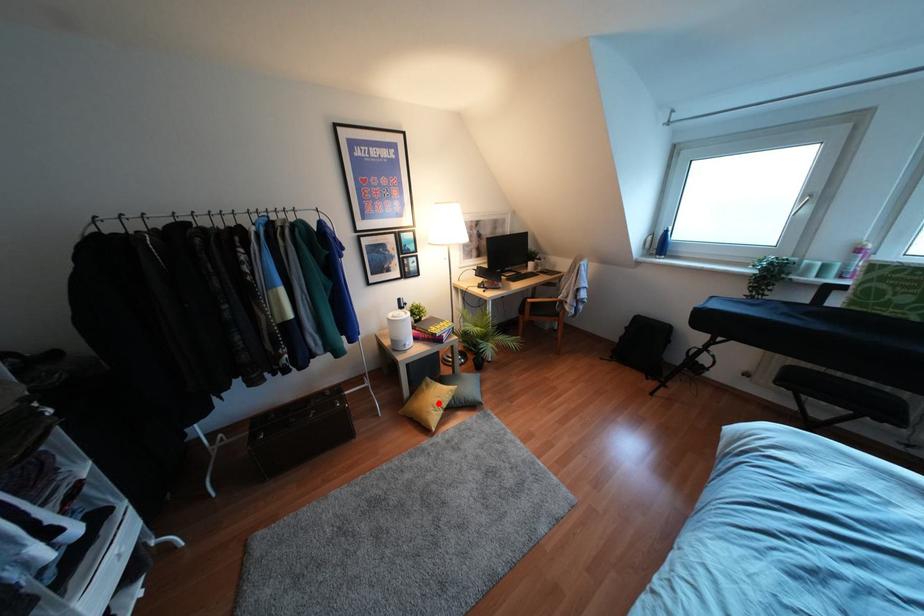
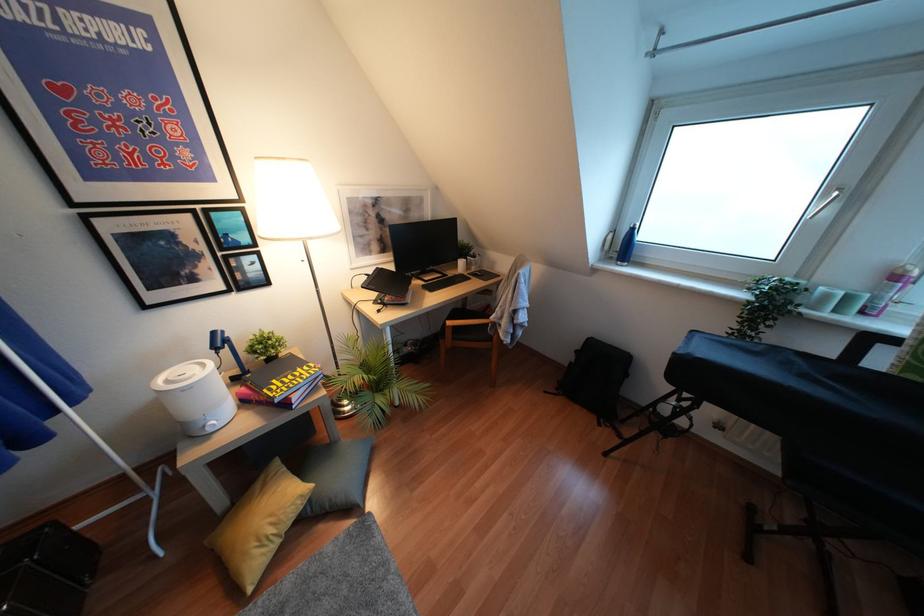
Locate, in the second image, the point that corresponds to the highlighted location in the first image.

(271, 530)